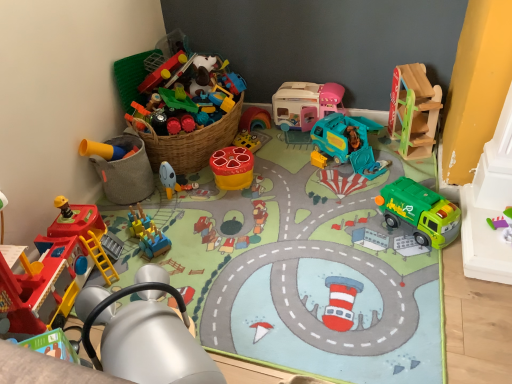
This screenshot has width=512, height=384. Identify the location of vacant space in between teal plastic garbage truck at center, acting as the 7th toy starting from the left, and blue plastic train at center, which appears as the 2th toy when viewed from the left. (249, 197).